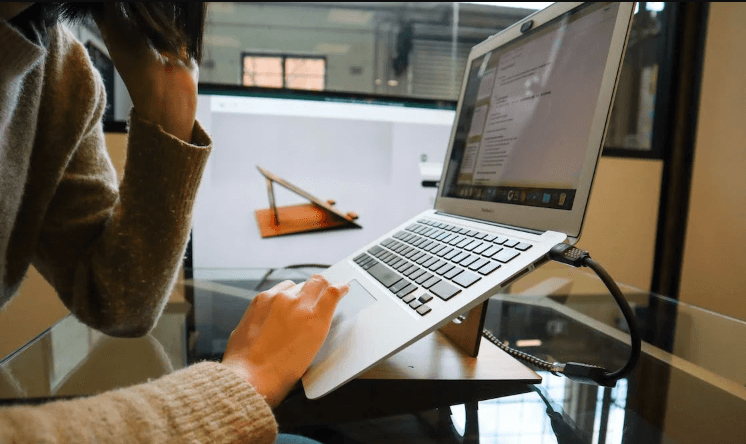
Locate an element on the screen. keyboard is located at coordinates (426, 258).